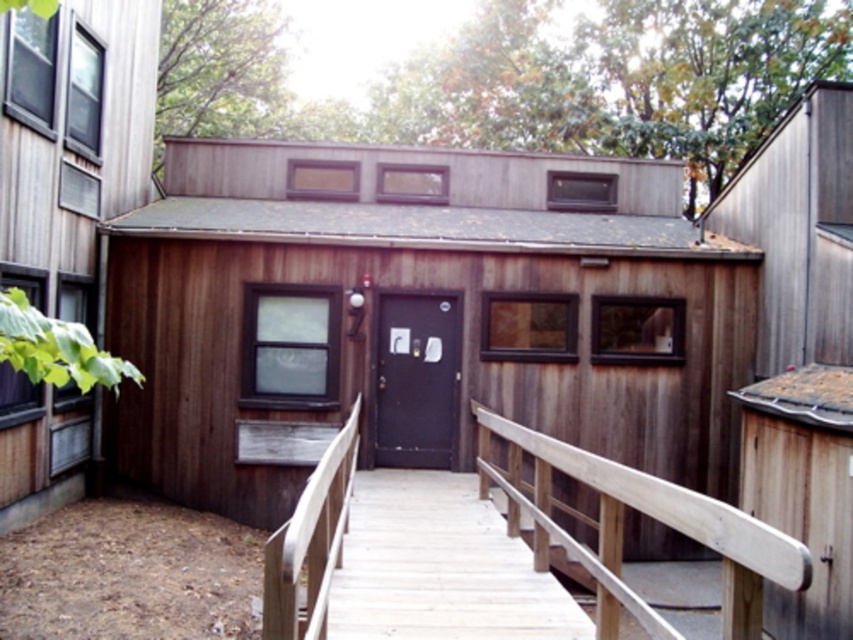
Between light brown wooden stairs at center and black matte door at center, which one has more height?

black matte door at center

Does point (456, 560) lie in front of point (404, 368)?

Yes, point (456, 560) is closer to viewer.

Who is more distant from viewer, (363, 486) or (408, 460)?

The point (408, 460) is more distant.

Find the location of a particular element. The image size is (853, 640). light brown wooden stairs at center is located at coordinates (439, 566).

Locate an element on the screen. light brown wooden stairs at center is located at coordinates (439, 566).

Is light brown wooden stairs at center above wooden handrail at center?

No, light brown wooden stairs at center is not above wooden handrail at center.

What do you see at coordinates (439, 566) in the screenshot? Image resolution: width=853 pixels, height=640 pixels. I see `light brown wooden stairs at center` at bounding box center [439, 566].

Image resolution: width=853 pixels, height=640 pixels. Identify the location of light brown wooden stairs at center. (439, 566).

This screenshot has height=640, width=853. What do you see at coordinates (622, 524) in the screenshot?
I see `wooden handrail at center` at bounding box center [622, 524].

Is wooden handrail at center closer to the viewer compared to black matte door at center?

Yes, it is.

Does point (584, 460) come closer to viewer compared to point (381, 420)?

Yes, point (584, 460) is in front of point (381, 420).

Identify the location of wooden handrail at center. (622, 524).